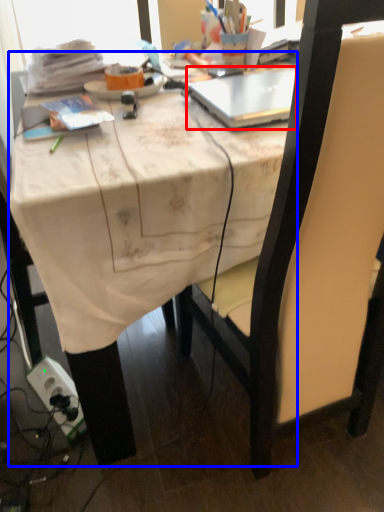
Question: Which of the following is the closest to the observer, laptop (highlighted by a red box) or desk (highlighted by a blue box)?

Choices:
 (A) laptop
 (B) desk

Answer: (B)